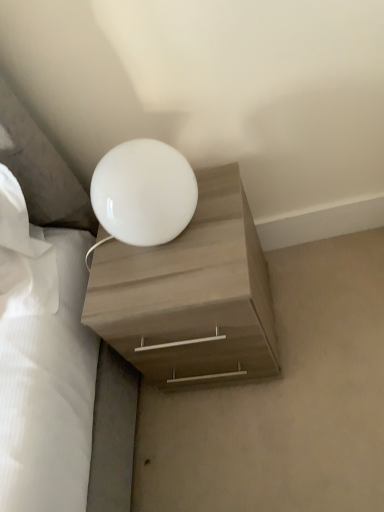
The height and width of the screenshot is (512, 384). Find the location of `vacant region in front of white glossy sphere at upper center`. vacant region in front of white glossy sphere at upper center is located at coordinates (186, 276).